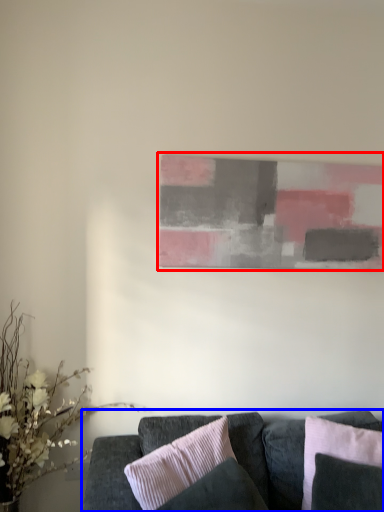
Question: Which object appears closest to the camera in this image, picture frame (highlighted by a red box) or studio couch (highlighted by a blue box)?

Choices:
 (A) picture frame
 (B) studio couch

Answer: (B)